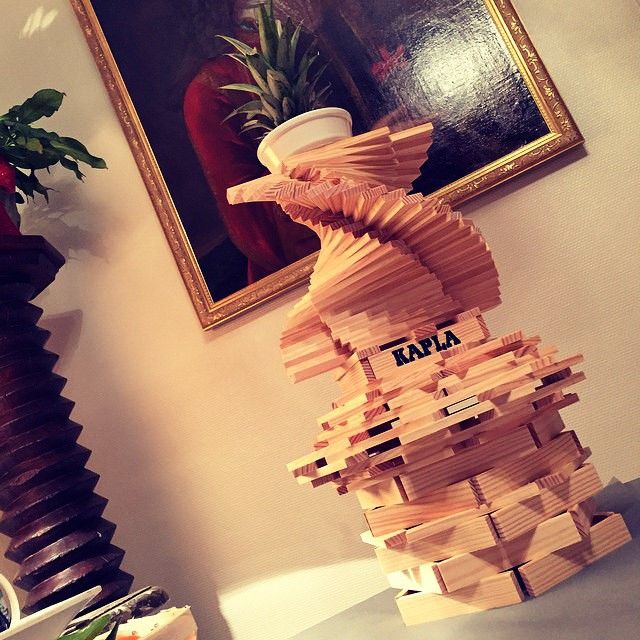
Where is `golden picture frame`? The width and height of the screenshot is (640, 640). golden picture frame is located at coordinates (214, 314).